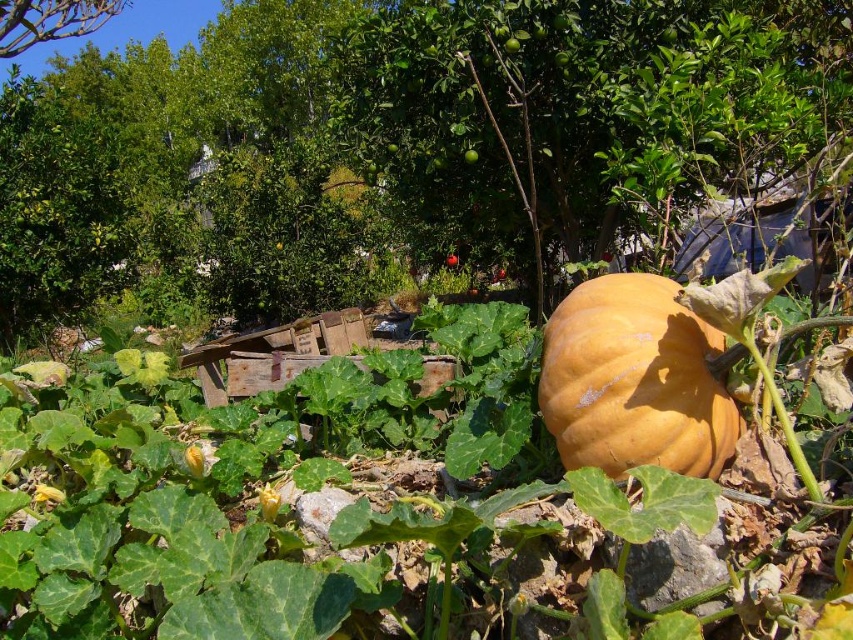
You are a gardener who needs to water the orange matte pumpkin at center. You have a hose that can reach 40 feet. Is the green leafy tree at upper left within the hose reach to water the pumpkin?

The distance between the orange matte pumpkin at center and the green leafy tree at upper left is 39.74 feet. Since the hose can reach 40 feet, the green leafy tree at upper left is within the hose reach to water the pumpkin.

You are a gardener planning to plant a new flower bed in the garden. Considering the orange matte pumpkin at center and the green leafy tree at upper left, which object takes up more space in the garden?

The green leafy tree at upper left occupies more space than the orange matte pumpkin at center.

You are standing in the garden and want to take a photo of the orange matte pumpkin at center without the green leafy tree at upper left appearing in the background. Is the current position of the pumpkin suitable for this?

The orange matte pumpkin at center is in front of the green leafy tree at upper left, so the tree will appear in the background of the photo. To avoid this, you need to reposition the pumpkin or move to a different angle where the tree is not behind it.